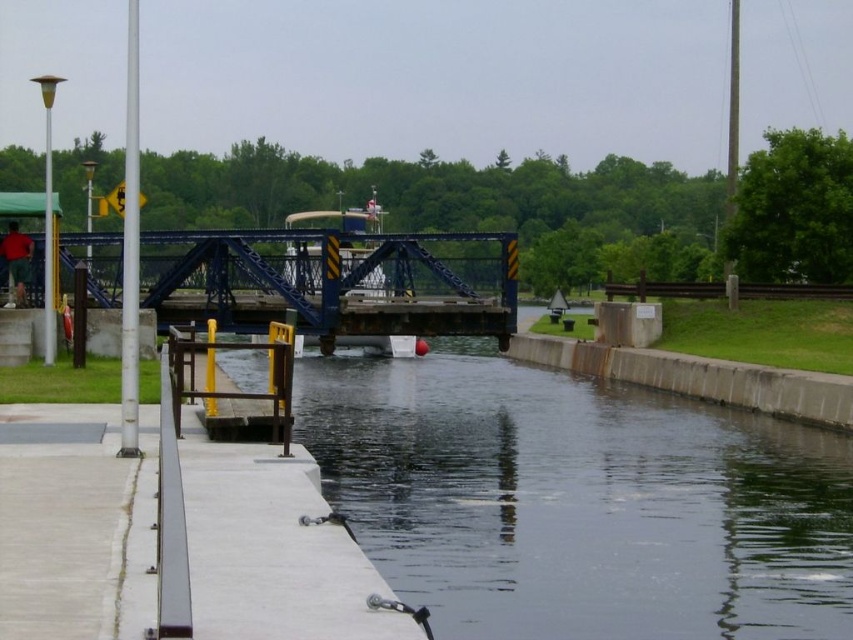
Question: Is smooth concrete river at center to the left of blue metallic bridge at center from the viewer's perspective?

Choices:
 (A) no
 (B) yes

Answer: (A)

Question: Which object appears closest to the camera in this image?

Choices:
 (A) smooth concrete river at center
 (B) blue metallic bridge at center

Answer: (A)

Question: Which point is farther to the camera?

Choices:
 (A) (705, 484)
 (B) (305, 300)

Answer: (B)

Question: Among these points, which one is nearest to the camera?

Choices:
 (A) (115, 243)
 (B) (486, 481)

Answer: (B)

Question: Can you confirm if smooth concrete river at center is positioned to the left of blue metallic bridge at center?

Choices:
 (A) yes
 (B) no

Answer: (B)

Question: Considering the relative positions of smooth concrete river at center and blue metallic bridge at center in the image provided, where is smooth concrete river at center located with respect to blue metallic bridge at center?

Choices:
 (A) below
 (B) above

Answer: (A)